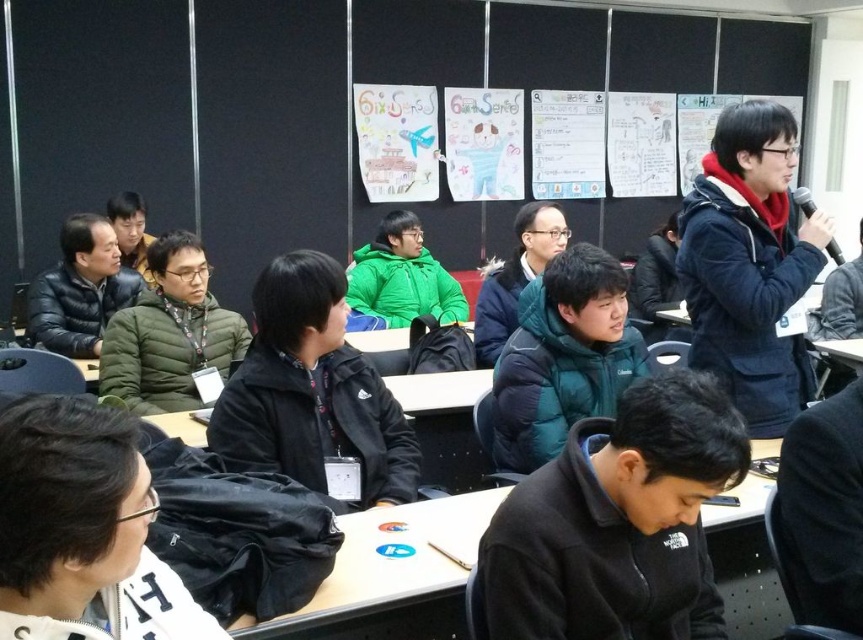
You are a student sitting at the back of the classroom and want to borrow a jacket from either the teal down jacket at center or the black fuzzy jacket at upper left. Which jacket would you choose if you prefer a wider one?

You should choose the teal down jacket at center because its width surpasses the black fuzzy jacket at upper left.

You are a student sitting in the classroom and need to place a notebook on the white plastic table at center. Can you do this without moving the green matte jacket at center?

The white plastic table at center is positioned under green matte jacket at center, so you can place the notebook on the white plastic table at center without moving the green matte jacket at center.